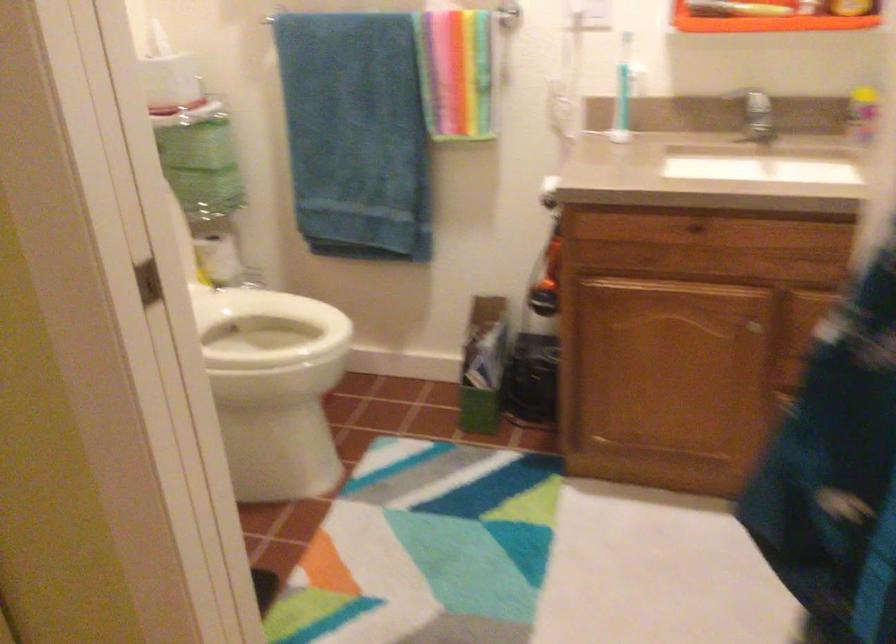
This screenshot has width=896, height=644. Describe the element at coordinates (265, 328) in the screenshot. I see `the white toilet seat` at that location.